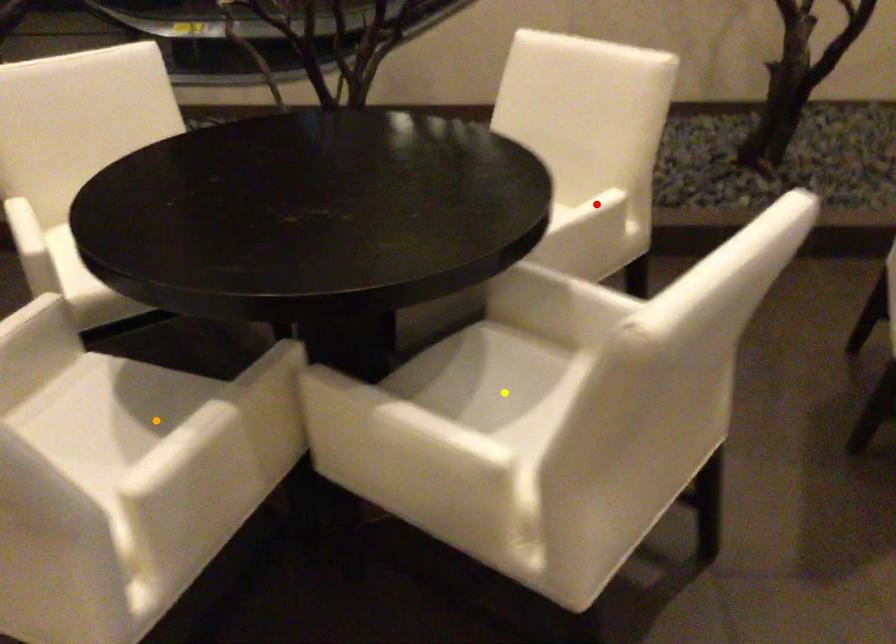
Based on the photo, order these from nearest to farthest:
- yellow point
- red point
- orange point

orange point → yellow point → red point